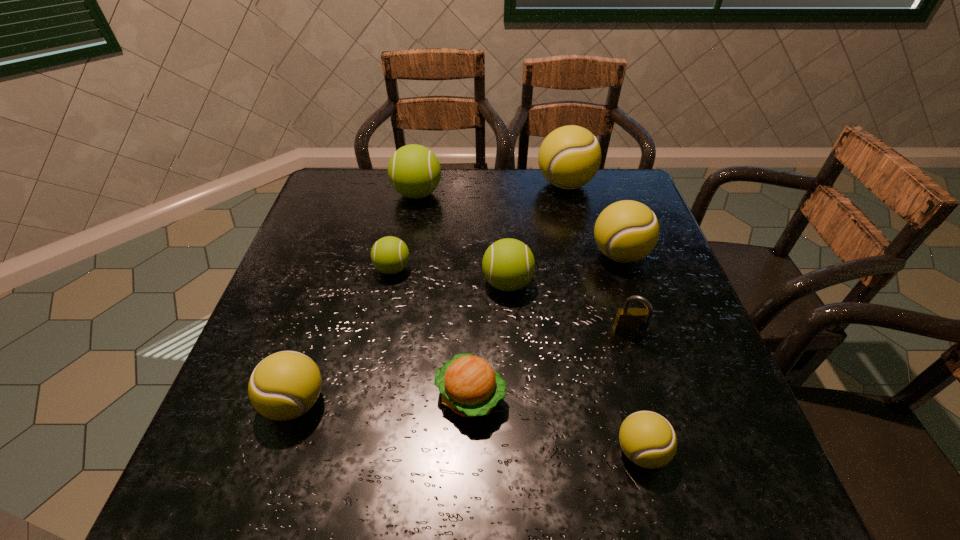
This screenshot has height=540, width=960. Identify the location of empty space between the smallest yellow tennis ball and the third nearest yellow tennis ball. (630, 353).

Locate an element on the screen. The height and width of the screenshot is (540, 960). empty space between the second biggest green tennis ball and the hamburger is located at coordinates (489, 340).

This screenshot has height=540, width=960. I want to click on free space between the hamburger and the smallest yellow tennis ball, so click(x=556, y=424).

Point out which object is positioned as the nearest to the second farthest yellow tennis ball. Please provide its 2D coordinates. Your answer should be formatted as a tuple, i.e. [(x, y)], where the tuple contains the x and y coordinates of a point satisfying the conditions above.

[(508, 264)]

Identify the location of the fourth closest object to the third smallest yellow tennis ball. The width and height of the screenshot is (960, 540). (470, 387).

Locate an element on the screen. tennis ball that is the third nearest to the hamburger is located at coordinates (285, 385).

Choose which tennis ball is the fifth nearest neighbor to the fourth tennis ball from right to left. Please provide its 2D coordinates. Your answer should be formatted as a tuple, i.e. [(x, y)], where the tuple contains the x and y coordinates of a point satisfying the conditions above.

[(648, 440)]

Where is `yellow tennis ball identified as the second closest to the leftmost tennis ball`? Image resolution: width=960 pixels, height=540 pixels. yellow tennis ball identified as the second closest to the leftmost tennis ball is located at coordinates (626, 231).

Identify which yellow tennis ball is the second nearest to the smallest yellow tennis ball. Please provide its 2D coordinates. Your answer should be formatted as a tuple, i.e. [(x, y)], where the tuple contains the x and y coordinates of a point satisfying the conditions above.

[(285, 385)]

Select which green tennis ball is the second closest to the rightmost green tennis ball. Please provide its 2D coordinates. Your answer should be formatted as a tuple, i.e. [(x, y)], where the tuple contains the x and y coordinates of a point satisfying the conditions above.

[(414, 171)]